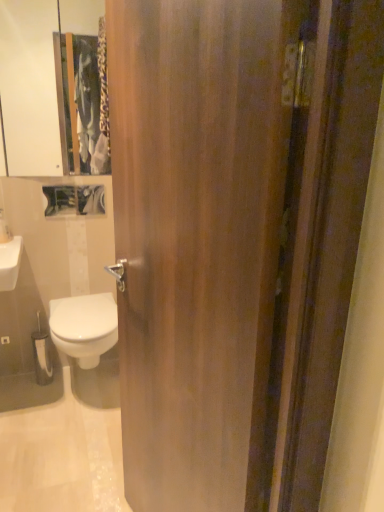
In order to face white glossy medicine cabinet at upper left, should I rotate leftwards or rightwards?

Turn left by 18.300 degrees to look at white glossy medicine cabinet at upper left.

Measure the distance between point (x=86, y=295) and camera.

The depth of point (x=86, y=295) is 8.14 feet.

The height and width of the screenshot is (512, 384). I want to click on white glossy medicine cabinet at upper left, so click(29, 87).

Relative to white glossy medicine cabinet at upper left, is wooden door at center in front or behind?

Visually, wooden door at center is located in front of white glossy medicine cabinet at upper left.

Looking at this image, from the image's perspective, does wooden door at center appear lower than white glossy medicine cabinet at upper left?

Yes, from the image's perspective, wooden door at center is beneath white glossy medicine cabinet at upper left.

How different are the orientations of wooden door at center and white glossy medicine cabinet at upper left in degrees?

73.9 degrees.

Which of these two, white glossy bidet at lower left or wooden door at center, stands shorter?

white glossy bidet at lower left.

Which object is wider, white glossy bidet at lower left or wooden door at center?

white glossy bidet at lower left.

Is white glossy bidet at lower left touching wooden door at center?

No, white glossy bidet at lower left is not beside wooden door at center.

Looking at this image, which point is more forward, [6,228] or [84,30]?

The point [6,228] is more forward.

You are a GUI agent. You are given a task and a screenshot of the screen. Output one action in this format:
    pyautogui.click(x=<x>, y=<y>)
    Task: Click on the toiletry below the white glossy medicine cabinet at upper left (from the image's perspective)
    This screenshot has height=512, width=384.
    Given the screenshot: What is the action you would take?
    pos(4,229)

From a real-world perspective, is white glossy soap dispenser at upper left beneath white glossy medicine cabinet at upper left?

Correct, in the physical world, white glossy soap dispenser at upper left is lower than white glossy medicine cabinet at upper left.

From the image's perspective, relative to white glossy bidet at lower left, is white glossy soap dispenser at upper left above or below?

Based on their image positions, white glossy soap dispenser at upper left is located above white glossy bidet at lower left.

Is white glossy soap dispenser at upper left not inside white glossy bidet at lower left?

Yes, white glossy soap dispenser at upper left is outside of white glossy bidet at lower left.

In terms of width, does white glossy soap dispenser at upper left look wider or thinner when compared to white glossy bidet at lower left?

white glossy soap dispenser at upper left is thinner than white glossy bidet at lower left.

Which of these two, white glossy soap dispenser at upper left or white glossy bidet at lower left, is bigger?

Bigger between the two is white glossy bidet at lower left.

Which object is closer to the camera, wooden door at center or white glossy bidet at lower left?

wooden door at center is closer to the camera.

From the image's perspective, is wooden door at center located beneath white glossy bidet at lower left?

No, from the image's perspective, wooden door at center is not beneath white glossy bidet at lower left.

Can you confirm if wooden door at center is taller than white glossy bidet at lower left?

Indeed, wooden door at center has a greater height compared to white glossy bidet at lower left.

From a real-world perspective, is white glossy medicine cabinet at upper left beneath white glossy bidet at lower left?

No, from a real-world perspective, white glossy medicine cabinet at upper left is not beneath white glossy bidet at lower left.

Is white glossy medicine cabinet at upper left facing towards white glossy bidet at lower left?

No, white glossy medicine cabinet at upper left is not turned towards white glossy bidet at lower left.

Does white glossy medicine cabinet at upper left have a larger size compared to white glossy bidet at lower left?

Actually, white glossy medicine cabinet at upper left might be smaller than white glossy bidet at lower left.

Which is closer, (38, 173) or (70, 333)?

Point (38, 173) appears to be farther away from the viewer than point (70, 333).

Between white glossy bidet at lower left and white glossy soap dispenser at upper left, which one is positioned in front?

white glossy bidet at lower left.

Does white glossy bidet at lower left touch white glossy soap dispenser at upper left?

No, white glossy bidet at lower left is not touching white glossy soap dispenser at upper left.

Considering the points (78, 337) and (1, 226), which point is behind, point (78, 337) or point (1, 226)?

The point (1, 226) is farther from the camera.

Locate an element on the screen. Image resolution: width=384 pixels, height=512 pixels. medicine cabinet above the wooden door at center (from a real-world perspective) is located at coordinates (29, 87).

At what (x,y) coordinates should I click in order to perform the action: click on bidet below the wooden door at center (from the image's perspective). Please return your answer as a coordinate pair (x, y). Looking at the image, I should click on (84, 327).

Consider the image. When comparing their distances from wooden door at center, does white glossy soap dispenser at upper left or white glossy medicine cabinet at upper left seem further?

white glossy medicine cabinet at upper left lies further to wooden door at center than the other object.

From the image, which object appears to be farther from white glossy bidet at lower left, white glossy soap dispenser at upper left or wooden door at center?

wooden door at center is further to white glossy bidet at lower left.

When comparing their distances from white glossy bidet at lower left, does white glossy medicine cabinet at upper left or wooden door at center seem closer?

wooden door at center lies closer to white glossy bidet at lower left than the other object.

Which object lies further to the anchor point white glossy bidet at lower left, wooden door at center or white glossy medicine cabinet at upper left?

Based on the image, white glossy medicine cabinet at upper left appears to be further to white glossy bidet at lower left.

Estimate the real-world distances between objects in this image. Which object is closer to white glossy soap dispenser at upper left, white glossy medicine cabinet at upper left or white glossy bidet at lower left?

Based on the image, white glossy bidet at lower left appears to be nearer to white glossy soap dispenser at upper left.

Looking at the image, which one is located further to wooden door at center, white glossy bidet at lower left or white glossy soap dispenser at upper left?

Among the two, white glossy soap dispenser at upper left is located further to wooden door at center.

Considering their positions, is white glossy bidet at lower left positioned further to white glossy soap dispenser at upper left than wooden door at center?

wooden door at center lies further to white glossy soap dispenser at upper left than the other object.

Which object lies further to the anchor point wooden door at center, white glossy bidet at lower left or white glossy medicine cabinet at upper left?

white glossy medicine cabinet at upper left is positioned further to the anchor wooden door at center.

Identify the location of medicine cabinet between wooden door at center and white glossy bidet at lower left from front to back. The width and height of the screenshot is (384, 512). (29, 87).

Identify the location of bidet between wooden door at center and white glossy soap dispenser at upper left along the z-axis. The width and height of the screenshot is (384, 512). (84, 327).

Locate an element on the screen. The image size is (384, 512). toiletry between white glossy medicine cabinet at upper left and white glossy bidet at lower left in the vertical direction is located at coordinates pos(4,229).

I want to click on medicine cabinet positioned between wooden door at center and white glossy soap dispenser at upper left from near to far, so click(29, 87).